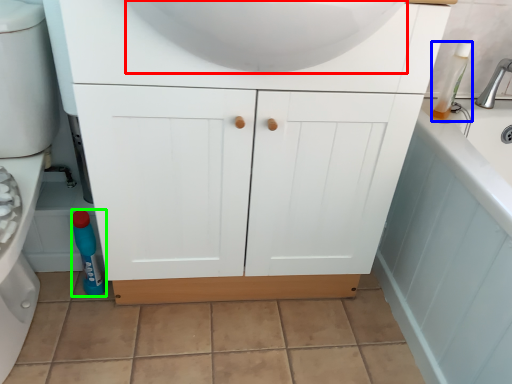
Question: Based on their relative distances, which object is nearer to sink (highlighted by a red box)? Choose from cleaning product (highlighted by a blue box) and bottle (highlighted by a green box).

Choices:
 (A) cleaning product
 (B) bottle

Answer: (A)